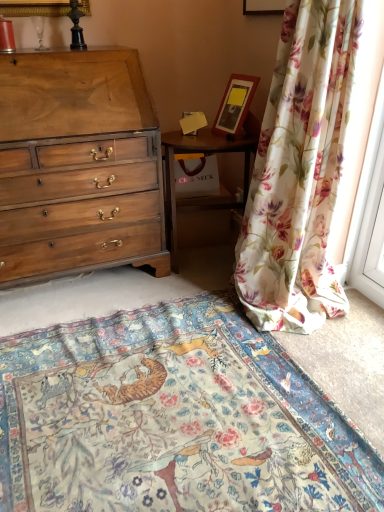
Question: Should I look upward or downward to see floral carpet at center?

Choices:
 (A) up
 (B) down

Answer: (B)

Question: Is floral fabric curtain at right positioned before wooden picture frame at upper center, the 2th picture frame from the bottom?

Choices:
 (A) yes
 (B) no

Answer: (A)

Question: Is there a large distance between floral fabric curtain at right and wooden picture frame at upper center, the 2th picture frame from the bottom?

Choices:
 (A) yes
 (B) no

Answer: (B)

Question: Is floral fabric curtain at right behind wooden picture frame at upper center, which is the 1th picture frame in top-to-bottom order?

Choices:
 (A) no
 (B) yes

Answer: (A)

Question: Is floral fabric curtain at right at the right side of wooden picture frame at upper center, the 2th picture frame from the bottom?

Choices:
 (A) no
 (B) yes

Answer: (B)

Question: Does floral fabric curtain at right have a smaller size compared to wooden picture frame at upper center, which is the 1th picture frame in top-to-bottom order?

Choices:
 (A) yes
 (B) no

Answer: (B)

Question: Is floral fabric curtain at right positioned beyond the bounds of wooden picture frame at upper center, the 2th picture frame from the bottom?

Choices:
 (A) no
 (B) yes

Answer: (B)

Question: Is the depth of floral carpet at center less than that of wooden picture frame at upper center, which is the 1th picture frame in top-to-bottom order?

Choices:
 (A) no
 (B) yes

Answer: (B)

Question: Is floral carpet at center placed right next to wooden picture frame at upper center, the 2th picture frame from the bottom?

Choices:
 (A) no
 (B) yes

Answer: (A)

Question: Is floral carpet at center turned away from wooden picture frame at upper center, the 2th picture frame from the bottom?

Choices:
 (A) yes
 (B) no

Answer: (B)

Question: Considering the relative positions of floral carpet at center and wooden picture frame at upper center, which is the 1th picture frame in top-to-bottom order, in the image provided, is floral carpet at center to the left of wooden picture frame at upper center, which is the 1th picture frame in top-to-bottom order, from the viewer's perspective?

Choices:
 (A) yes
 (B) no

Answer: (A)

Question: From the image's perspective, is floral carpet at center located above wooden picture frame at upper center, the 2th picture frame from the bottom?

Choices:
 (A) no
 (B) yes

Answer: (A)

Question: Is floral carpet at center oriented towards wooden picture frame at upper center, which is the 1th picture frame in top-to-bottom order?

Choices:
 (A) no
 (B) yes

Answer: (A)

Question: From a real-world perspective, does wooden nightstand at center stand above floral fabric curtain at right?

Choices:
 (A) no
 (B) yes

Answer: (A)